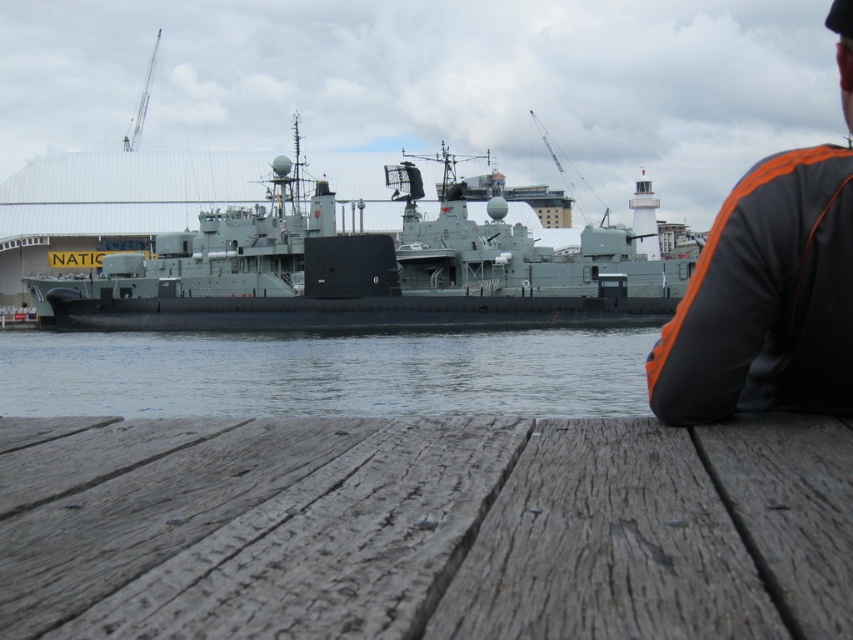
Question: Based on their relative distances, which object is nearer to the orange fabric jacket at upper right?

Choices:
 (A) clear water at center
 (B) green matte submarine at center
 (C) weathered wood dock at lower center

Answer: (C)

Question: Which object is the closest to the orange fabric jacket at upper right?

Choices:
 (A) green matte submarine at center
 (B) weathered wood dock at lower center
 (C) clear water at center

Answer: (B)

Question: Is green matte submarine at center below clear water at center?

Choices:
 (A) yes
 (B) no

Answer: (B)

Question: Based on their relative distances, which object is nearer to the clear water at center?

Choices:
 (A) weathered wood dock at lower center
 (B) orange fabric jacket at upper right
 (C) green matte submarine at center

Answer: (C)

Question: Can you confirm if weathered wood dock at lower center is smaller than clear water at center?

Choices:
 (A) yes
 (B) no

Answer: (A)

Question: Is clear water at center to the left of orange fabric jacket at upper right from the viewer's perspective?

Choices:
 (A) no
 (B) yes

Answer: (B)